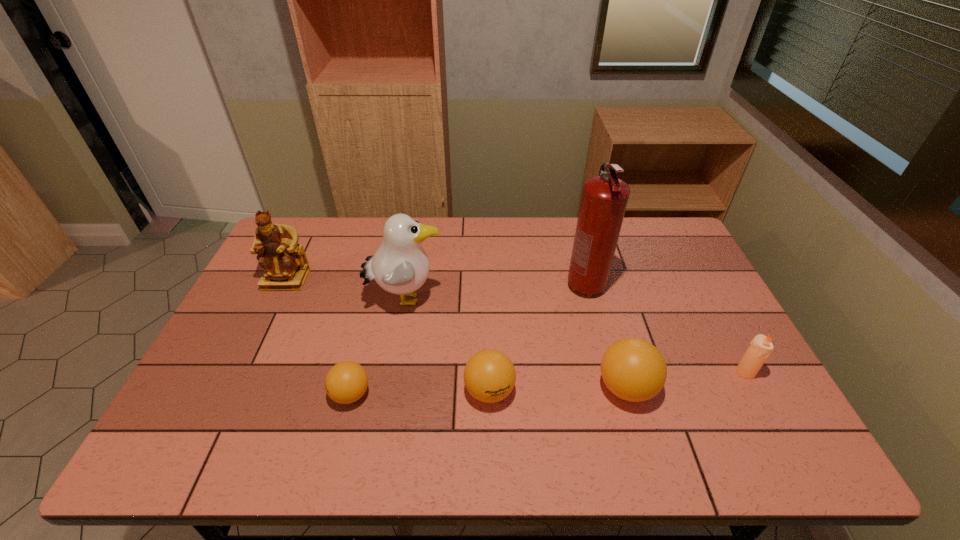
The width and height of the screenshot is (960, 540). Identify the location of free spot that satisfies the following two spatial constraints: 1. on the handle side the tallest object; 2. on the left side of the rightmost object. (608, 372).

Where is `vacant position in the image that satisfies the following two spatial constraints: 1. on the front side of the candle; 2. on the side with brand of the shortest object`? vacant position in the image that satisfies the following two spatial constraints: 1. on the front side of the candle; 2. on the side with brand of the shortest object is located at coordinates (757, 394).

Identify the location of free spot that satisfies the following two spatial constraints: 1. on the side with brand of the rightmost ping-pong ball; 2. on the side with brand of the second ping-pong ball from right to left. The height and width of the screenshot is (540, 960). (627, 391).